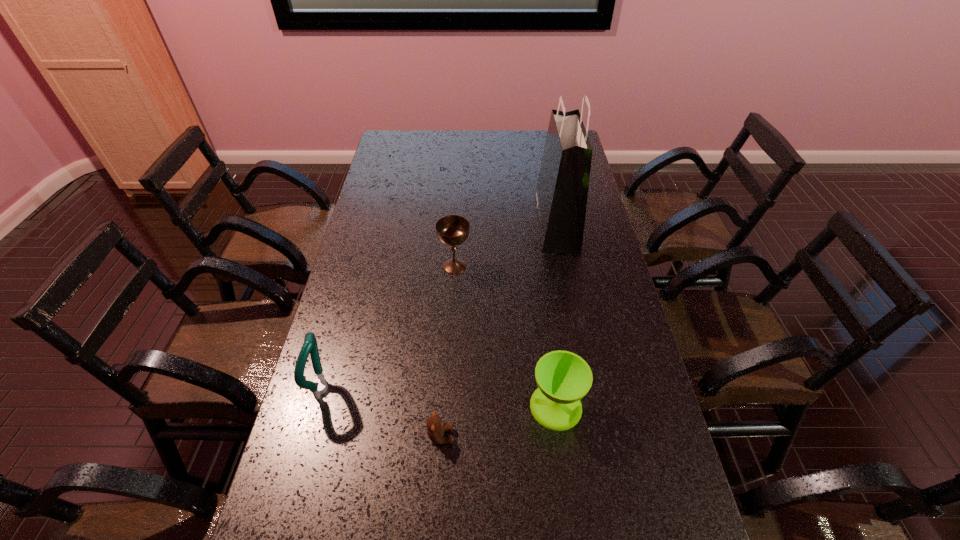
Identify the location of blank area located at the jaws of the fourth shortest object. The width and height of the screenshot is (960, 540). pyautogui.click(x=438, y=388).

Identify the location of free space located on the right of the chalice. (565, 266).

This screenshot has width=960, height=540. In order to click on vacant space situated 0.130m on the front of the second shortest object in this screenshot , I will do `click(566, 488)`.

Where is `vacant position located on the face of the teddy bear`? vacant position located on the face of the teddy bear is located at coordinates (558, 436).

This screenshot has height=540, width=960. I want to click on object that is at the left edge, so click(x=319, y=386).

The height and width of the screenshot is (540, 960). What are the coordinates of `object at the right edge` in the screenshot? It's located at (561, 194).

Locate an element on the screen. The width and height of the screenshot is (960, 540). vacant region at the far edge of the desktop is located at coordinates (424, 146).

In the image, there is a desktop. Where is `vacant space at the left edge`? vacant space at the left edge is located at coordinates (330, 328).

At what (x,y) coordinates should I click in order to perform the action: click on free space at the right edge. Please return your answer as a coordinate pair (x, y). Looking at the image, I should click on (593, 235).

The width and height of the screenshot is (960, 540). In order to click on free location at the far right corner in this screenshot , I will do `click(546, 132)`.